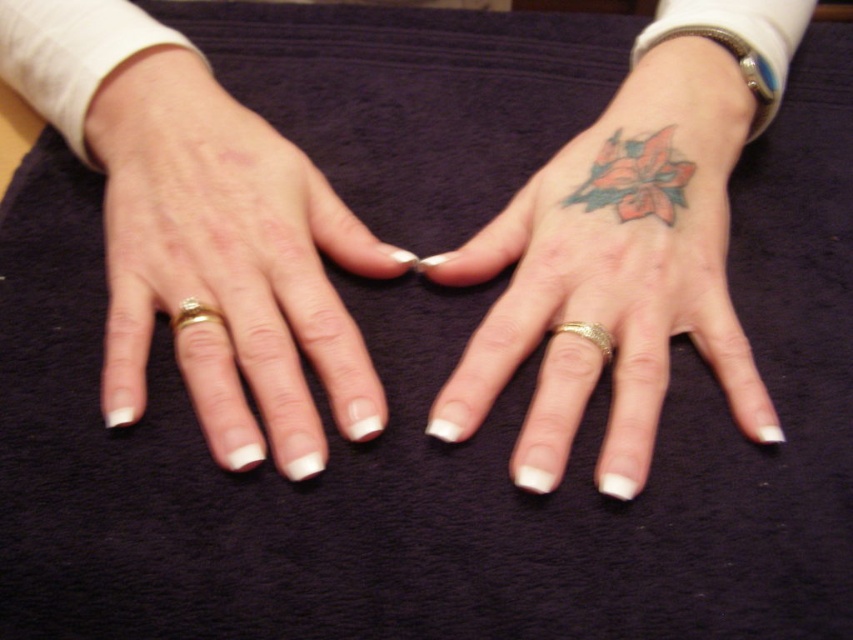
Question: Among these points, which one is nearest to the camera?

Choices:
 (A) (634, 145)
 (B) (189, 321)

Answer: (B)

Question: In this image, where is white matte ring at left located relative to gold metallic ring at left?

Choices:
 (A) left
 (B) right

Answer: (B)

Question: Does colored tattoo at upper right have a lesser width compared to gold metallic ring at left?

Choices:
 (A) yes
 (B) no

Answer: (B)

Question: Which of these objects is positioned farthest from the white matte ring at left?

Choices:
 (A) colored ink flower at upper right
 (B) gold textured band at right middle finger
 (C) colored tattoo at upper right
 (D) gold metallic ring at left

Answer: (A)

Question: Which point appears closest to the camera in this image?

Choices:
 (A) (601, 332)
 (B) (624, 161)
 (C) (287, 250)
 (D) (178, 330)

Answer: (A)

Question: Does white matte ring at left lie in front of gold textured band at right middle finger?

Choices:
 (A) yes
 (B) no

Answer: (A)